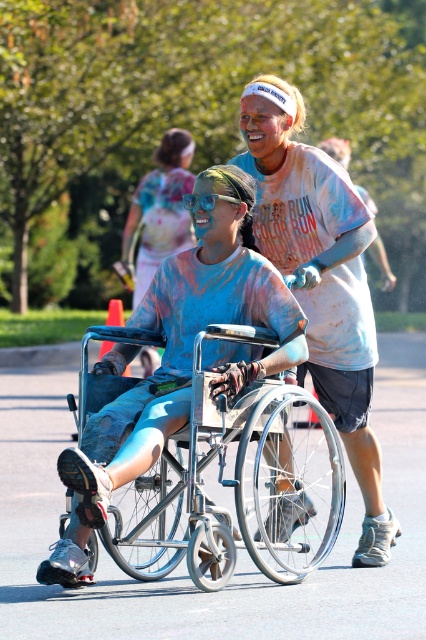
Question: Does white cotton shirt at upper center have a smaller size compared to blue painted skin at center?

Choices:
 (A) yes
 (B) no

Answer: (A)

Question: Which object is positioned farthest from the white cotton shirt at upper center?

Choices:
 (A) blue painted skin at center
 (B) silver metallic wheelchair at center

Answer: (A)

Question: Is silver metallic wheelchair at center thinner than white cotton shirt at upper center?

Choices:
 (A) no
 (B) yes

Answer: (A)

Question: Which point is closer to the camera taking this photo?

Choices:
 (A) (149, 243)
 (B) (368, 227)

Answer: (B)

Question: Does silver metallic wheelchair at center have a greater width compared to blue painted skin at center?

Choices:
 (A) yes
 (B) no

Answer: (A)

Question: Based on their relative distances, which object is nearer to the silver metallic wheelchair at center?

Choices:
 (A) blue painted skin at center
 (B) white cotton shirt at upper center

Answer: (B)